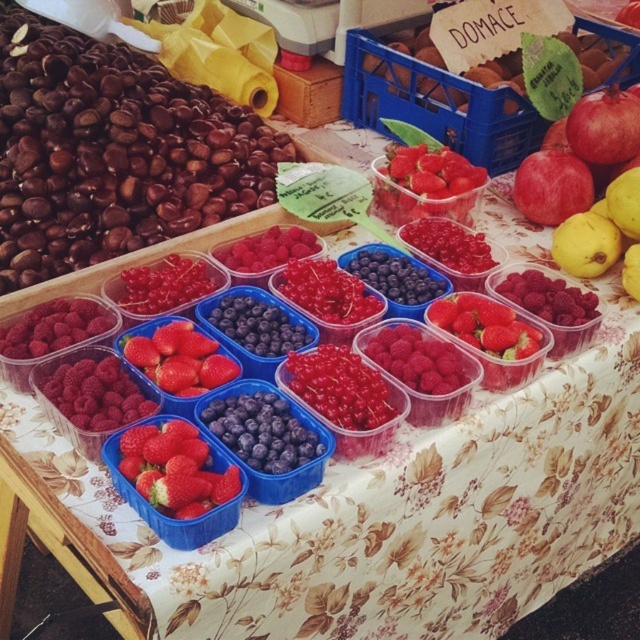
Is shiny red strawberries at center wider than red matte strawberries at center?

No, shiny red strawberries at center is not wider than red matte strawberries at center.

Find the location of a particular element. The height and width of the screenshot is (640, 640). shiny red strawberries at center is located at coordinates (173, 468).

Does red matte strawberries at center lie behind red glossy pomegranate at upper right?

No, red matte strawberries at center is closer to the viewer.

Does red matte strawberries at center have a lesser width compared to red glossy pomegranate at upper right?

In fact, red matte strawberries at center might be wider than red glossy pomegranate at upper right.

Locate an element on the screen. The height and width of the screenshot is (640, 640). red matte strawberries at center is located at coordinates (180, 358).

Which of these two, glossy plastic raspberry at center right or red glossy pomegranate at upper right, stands taller?

With more height is glossy plastic raspberry at center right.

I want to click on glossy plastic raspberry at center right, so click(548, 305).

Find the location of a particular element. glossy plastic raspberry at center right is located at coordinates [x=548, y=305].